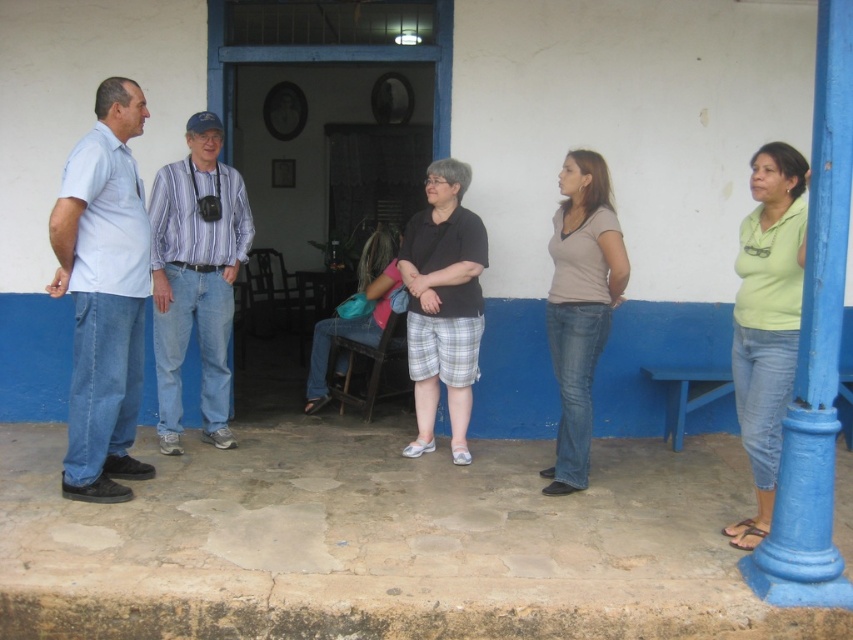
Is blue painted metal pole at right in front of matte brown shirt at center?

Yes.

Locate an element on the screen. The height and width of the screenshot is (640, 853). blue painted metal pole at right is located at coordinates (815, 353).

Who is more forward, (822, 460) or (608, 227)?

Point (822, 460)

Where is `blue painted metal pole at right`? The height and width of the screenshot is (640, 853). blue painted metal pole at right is located at coordinates (815, 353).

Who is shorter, light blue cotton shirt at left or pink fabric at center?

With less height is pink fabric at center.

Does light blue cotton shirt at left have a lesser width compared to pink fabric at center?

Yes, light blue cotton shirt at left is thinner than pink fabric at center.

The height and width of the screenshot is (640, 853). Describe the element at coordinates (103, 292) in the screenshot. I see `light blue cotton shirt at left` at that location.

I want to click on light blue cotton shirt at left, so click(x=103, y=292).

Between point (740, 522) and point (321, 352), which one is positioned in front?

Point (740, 522)

Who is positioned more to the left, green matte shirt at right or pink fabric at center?

pink fabric at center is more to the left.

Locate an element on the screen. Image resolution: width=853 pixels, height=640 pixels. green matte shirt at right is located at coordinates click(x=767, y=321).

You are a GUI agent. You are given a task and a screenshot of the screen. Output one action in this format:
    pyautogui.click(x=<x>, y=<y>)
    Task: Click on the green matte shirt at right
    Image resolution: width=853 pixels, height=640 pixels.
    Given the screenshot: What is the action you would take?
    pyautogui.click(x=767, y=321)